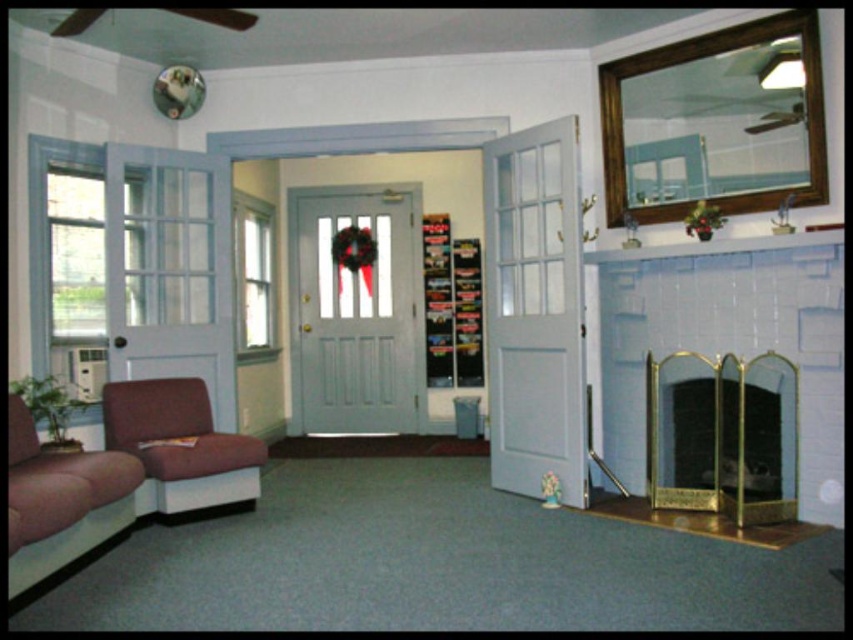
Question: Which of the following is the farthest from the observer?

Choices:
 (A) matte plastic figurine at lower center
 (B) velvet maroon couch at lower left

Answer: (A)

Question: Which of these objects is positioned farthest from the matte gray door at center?

Choices:
 (A) velvet maroon armchair at lower left
 (B) matte plastic figurine at lower center
 (C) white painted wood door at right
 (D) velvet maroon couch at lower left

Answer: (D)

Question: Is matte gray door at center bigger than velvet maroon armchair at lower left?

Choices:
 (A) no
 (B) yes

Answer: (A)

Question: Can you confirm if velvet maroon couch at lower left is positioned to the left of matte plastic figurine at lower center?

Choices:
 (A) no
 (B) yes

Answer: (B)

Question: In this image, where is velvet maroon armchair at lower left located relative to matte plastic figurine at lower center?

Choices:
 (A) below
 (B) above

Answer: (B)

Question: Which point appears farthest from the camera in this image?

Choices:
 (A) (697, 396)
 (B) (550, 301)
 (C) (44, 509)

Answer: (B)